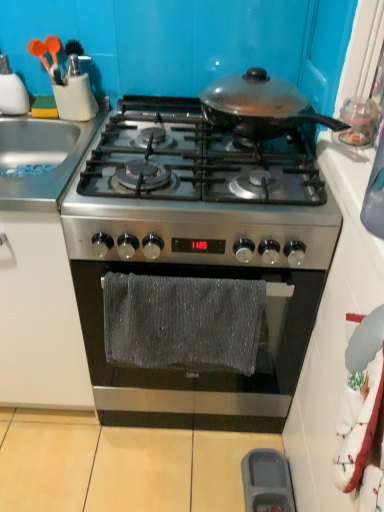
Question: In terms of width, does stainless steel sink at left look wider or thinner when compared to stainless steel gas stove at center, which appears as the 1th gas stove when viewed from the top?

Choices:
 (A) wide
 (B) thin

Answer: (B)

Question: From a real-world perspective, is stainless steel sink at left positioned above or below stainless steel gas stove at center, the second gas stove in the bottom-to-top sequence?

Choices:
 (A) above
 (B) below

Answer: (B)

Question: Which object is the farthest from the stainless steel gas stove at center, the second gas stove in the bottom-to-top sequence?

Choices:
 (A) shiny black pan at center, arranged as the 2th kitchen appliance when viewed from the left
 (B) stainless steel sink at left
 (C) matte plastic utensils at upper left, which is counted as the second kitchen appliance, starting from the right
 (D) stainless steel gas stove at center, marked as the second gas stove in a top-to-bottom arrangement
 (E) gray plastic tray at lower center

Answer: (E)

Question: Estimate the real-world distances between objects in this image. Which object is farther from the stainless steel gas stove at center, marked as the second gas stove in a top-to-bottom arrangement?

Choices:
 (A) matte plastic utensils at upper left, the first kitchen appliance when ordered from left to right
 (B) shiny black pan at center, arranged as the 2th kitchen appliance when viewed from the left
 (C) stainless steel gas stove at center, the second gas stove in the bottom-to-top sequence
 (D) gray textured towel at center
 (E) stainless steel sink at left

Answer: (A)